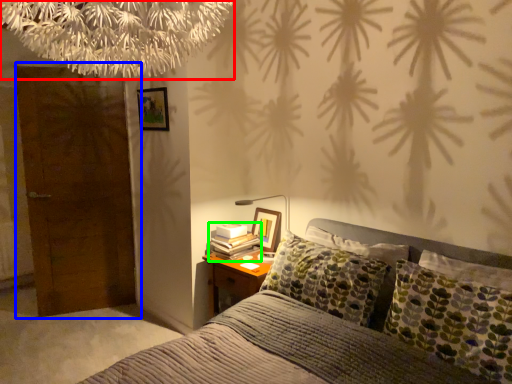
Question: Which is farther away from tree (highlighted by a red box)? door (highlighted by a blue box) or book (highlighted by a green box)?

Choices:
 (A) door
 (B) book

Answer: (A)